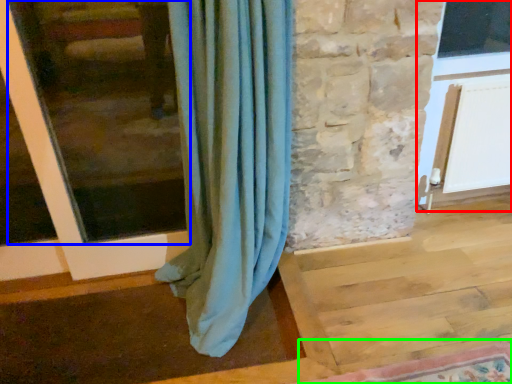
Question: Estimate the real-world distances between objects in this image. Which object is farther from screen door (highlighted by a red box), window frame (highlighted by a blue box) or mat (highlighted by a green box)?

Choices:
 (A) window frame
 (B) mat

Answer: (A)